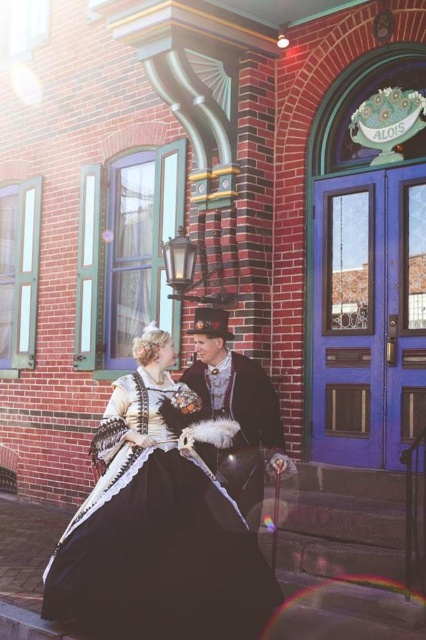
Question: Which of the following is the farthest from the observer?

Choices:
 (A) (161, 422)
 (B) (190, 387)

Answer: (B)

Question: In this image, where is black satin dress at center located relative to velvet black coat at center?

Choices:
 (A) above
 (B) below

Answer: (B)

Question: Which object is farther from the camera taking this photo?

Choices:
 (A) velvet black coat at center
 (B) black satin dress at center

Answer: (A)

Question: Does black satin dress at center have a smaller size compared to velvet black coat at center?

Choices:
 (A) no
 (B) yes

Answer: (A)

Question: Is black satin dress at center behind velvet black coat at center?

Choices:
 (A) no
 (B) yes

Answer: (A)

Question: Which point is closer to the camera?

Choices:
 (A) (112, 493)
 (B) (253, 380)

Answer: (A)